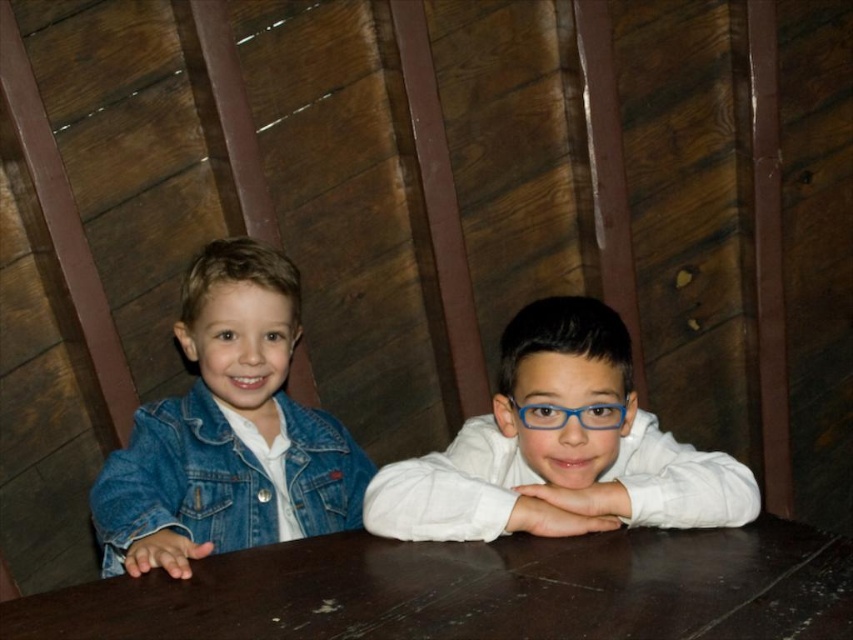
Question: Is white glossy shirt at center bigger than blue plastic glasses at center?

Choices:
 (A) no
 (B) yes

Answer: (B)

Question: Which point appears farthest from the camera in this image?

Choices:
 (A) (351, 499)
 (B) (556, 412)

Answer: (A)

Question: Is brown wooden table at center thinner than brushed denim jacket at lower left?

Choices:
 (A) yes
 (B) no

Answer: (B)

Question: Which is farther from the white glossy shirt at center?

Choices:
 (A) blue plastic glasses at center
 (B) brushed denim jacket at lower left

Answer: (B)

Question: Which object appears closest to the camera in this image?

Choices:
 (A) blue plastic glasses at center
 (B) brown wooden table at center
 (C) white glossy shirt at center

Answer: (B)

Question: Is white glossy shirt at center above brushed denim jacket at lower left?

Choices:
 (A) yes
 (B) no

Answer: (A)